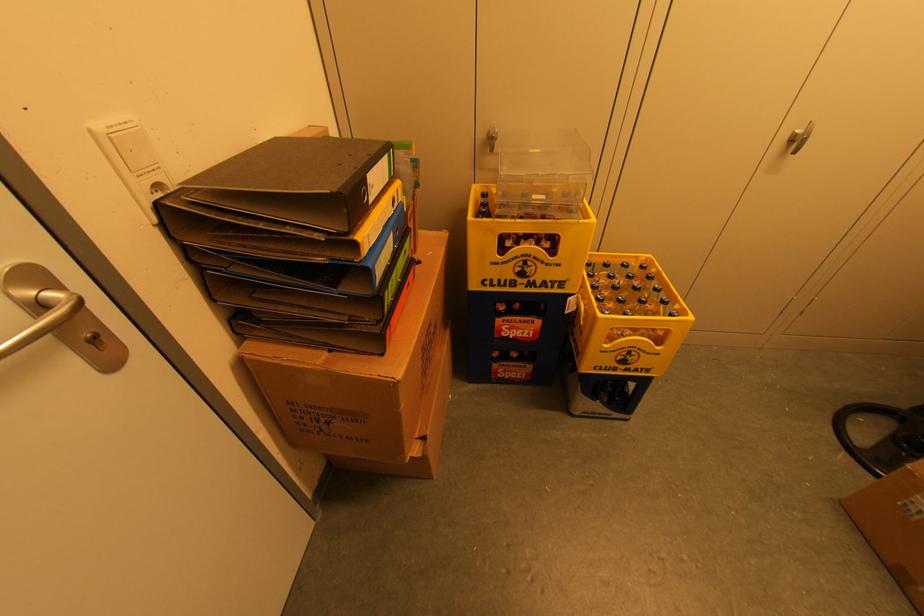
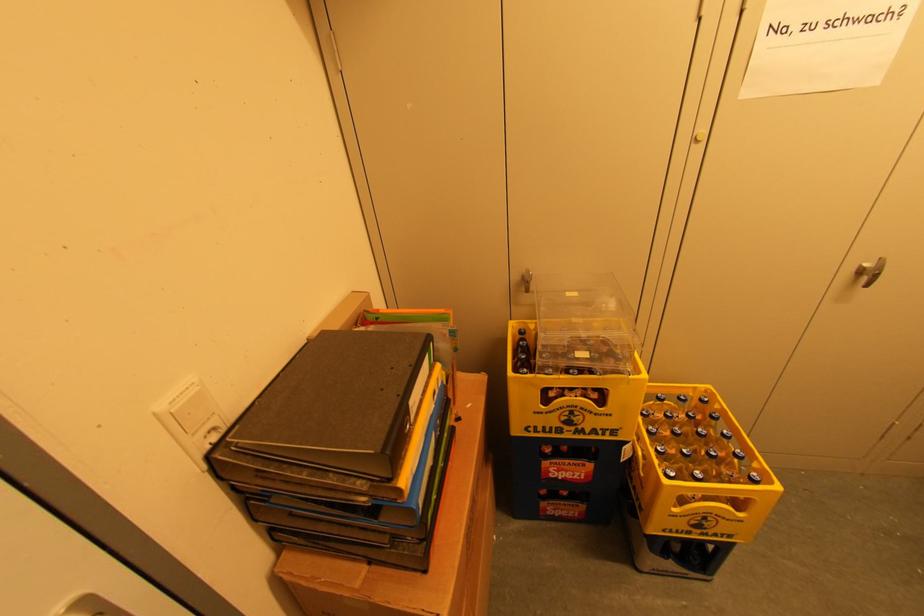
Where in the second image is the point corresponding to point 541,151 from the first image?

(578, 294)